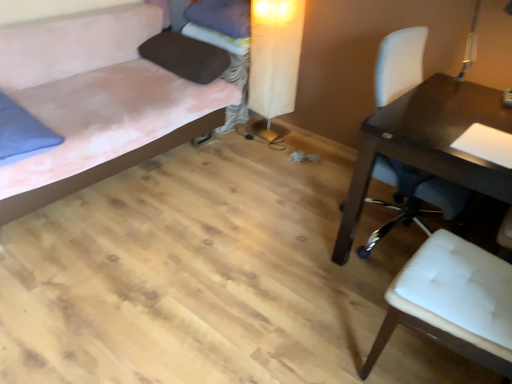
This screenshot has height=384, width=512. What are the coordinates of `vacant space situated on the left part of white leather chair at right, which ranks as the second chair in front-to-back order` in the screenshot? It's located at (283, 221).